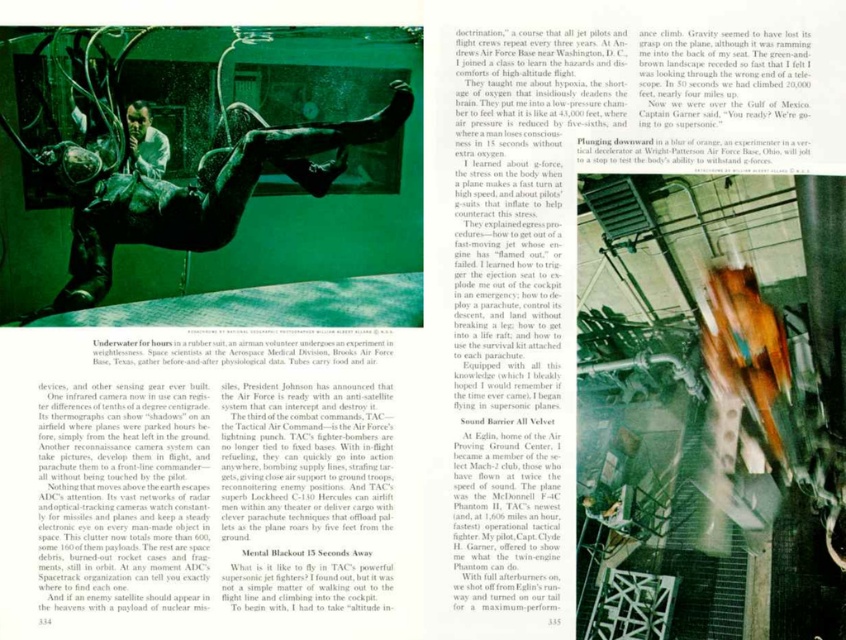
Question: Which of the following is the farthest from the observer?

Choices:
 (A) (179, 241)
 (B) (154, 134)

Answer: (B)

Question: Can you confirm if green matte man at center is positioned below matte black helmet at upper center?

Choices:
 (A) no
 (B) yes

Answer: (B)

Question: Does green matte man at center lie in front of matte black helmet at upper center?

Choices:
 (A) no
 (B) yes

Answer: (B)

Question: Is green matte man at center above matte black helmet at upper center?

Choices:
 (A) no
 (B) yes

Answer: (A)